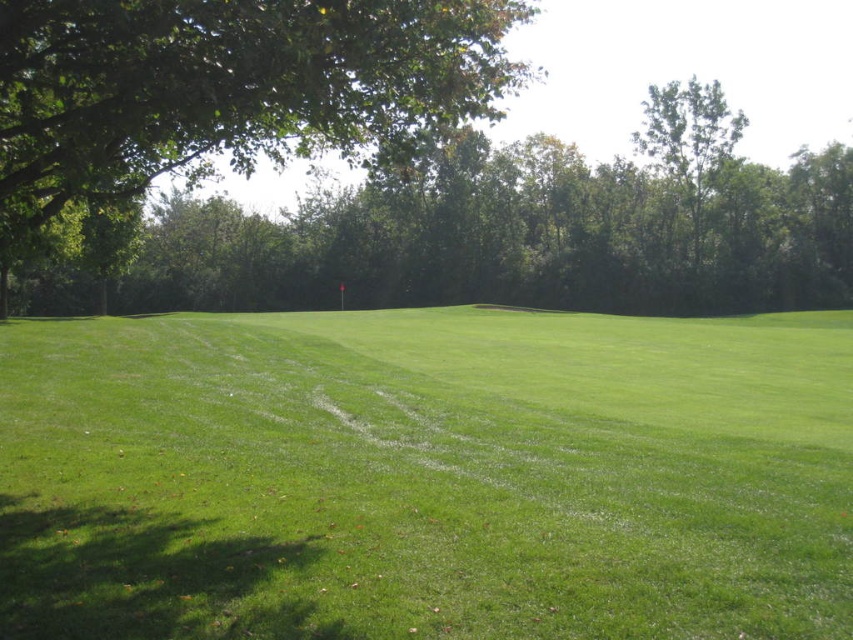
Question: Observing the image, what is the correct spatial positioning of green leafy tree at upper left in reference to green leafy tree at upper right?

Choices:
 (A) below
 (B) above

Answer: (A)

Question: Can you confirm if green grass at center is wider than green leafy tree at upper left?

Choices:
 (A) yes
 (B) no

Answer: (B)

Question: Which object is positioned farthest from the green leafy tree at upper right?

Choices:
 (A) green leafy tree at upper left
 (B) green grass at center

Answer: (A)

Question: Which point appears farthest from the camera in this image?

Choices:
 (A) (78, 556)
 (B) (90, 26)
 (C) (693, 240)

Answer: (C)

Question: Which point is closer to the camera taking this photo?

Choices:
 (A) (741, 122)
 (B) (340, 86)
 (C) (538, 586)

Answer: (C)

Question: Can you confirm if green leafy tree at upper left is positioned above green leafy tree at upper right?

Choices:
 (A) yes
 (B) no

Answer: (B)